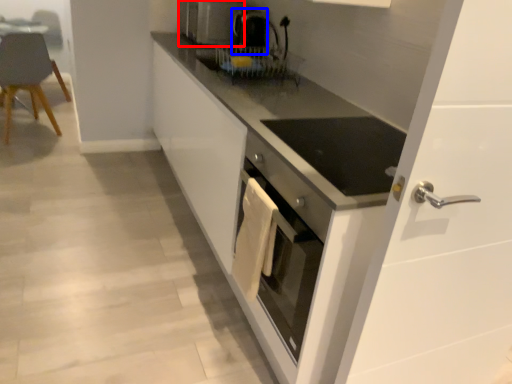
Question: Which object appears farthest to the camera in this image, home appliance (highlighted by a red box) or coffee machine (highlighted by a blue box)?

Choices:
 (A) home appliance
 (B) coffee machine

Answer: (A)